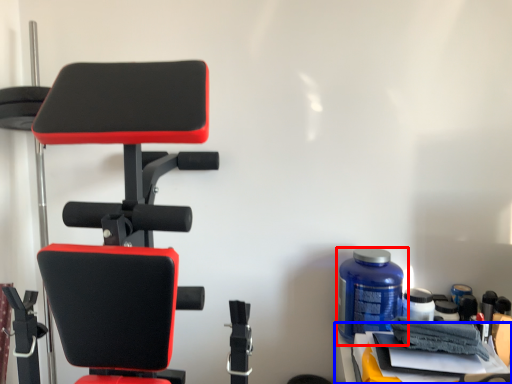
Question: Which object appears closest to the camera in this image, bottle (highlighted by a red box) or table (highlighted by a blue box)?

Choices:
 (A) bottle
 (B) table

Answer: (B)